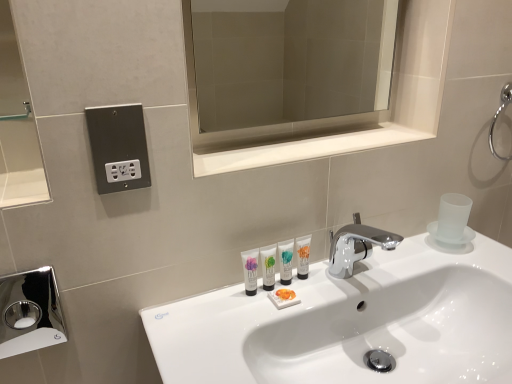
The image size is (512, 384). Find the location of `free spot to the right of white glossy tube at center, acting as the 4th mouthwash starting from the right`. free spot to the right of white glossy tube at center, acting as the 4th mouthwash starting from the right is located at coordinates (324, 293).